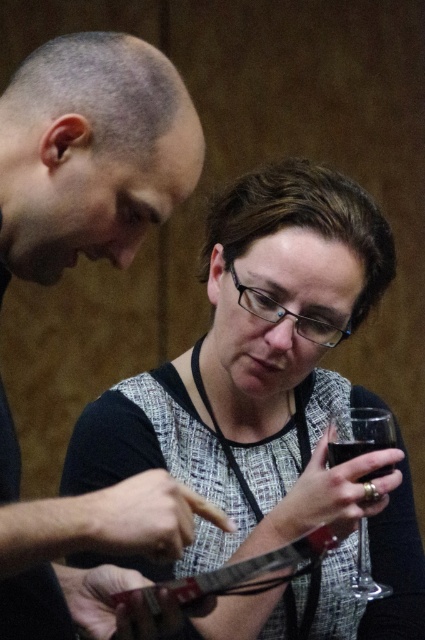
Who is shorter, matte black shirt at left or transparent glass at lower center?

Standing shorter between the two is transparent glass at lower center.

This screenshot has width=425, height=640. What do you see at coordinates (90, 154) in the screenshot? I see `matte black shirt at left` at bounding box center [90, 154].

Does point (104, 540) come farther from viewer compared to point (362, 577)?

No, it is not.

You are a GUI agent. You are given a task and a screenshot of the screen. Output one action in this format:
    pyautogui.click(x=<x>, y=<y>)
    Task: Click on the matte black shirt at left
    This screenshot has width=425, height=640.
    Given the screenshot: What is the action you would take?
    (90, 154)

Between speckled fabric dress at center and matte black shirt at left, which one appears on the right side from the viewer's perspective?

Positioned to the right is speckled fabric dress at center.

Identify the location of speckled fabric dress at center. The height and width of the screenshot is (640, 425). (269, 412).

Find the location of a particular element. speckled fabric dress at center is located at coordinates (269, 412).

Who is positioned more to the left, matte black shirt at left or clear glass at lower center?

matte black shirt at left

Is matte black shirt at left shorter than clear glass at lower center?

No.

Between point (64, 262) and point (365, 442), which one is positioned in front?

Point (64, 262) is more forward.

Where is `matte black shirt at left`? The image size is (425, 640). matte black shirt at left is located at coordinates (90, 154).